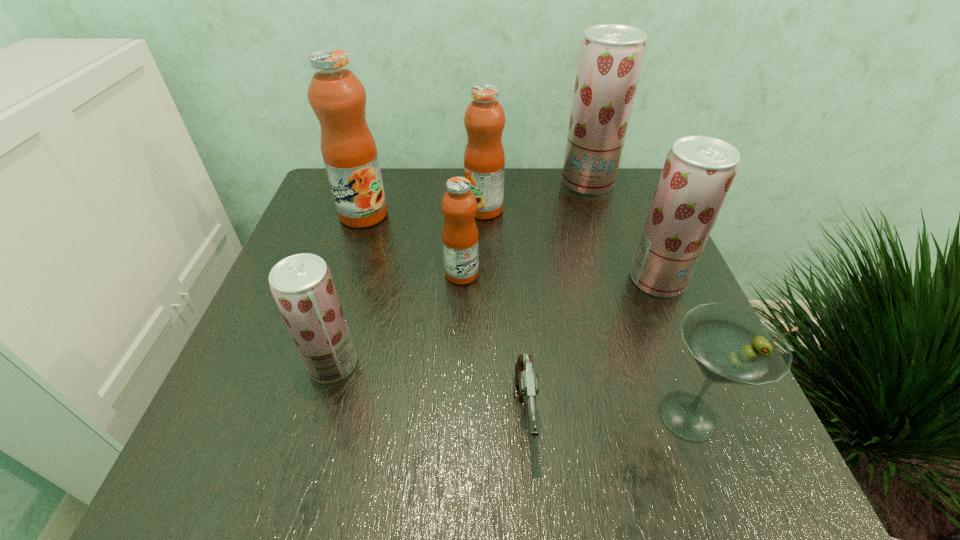
Image resolution: width=960 pixels, height=540 pixels. I want to click on martini that is at the near edge, so pyautogui.click(x=730, y=344).

This screenshot has width=960, height=540. Find the location of `pistol that is at the near edge`. pistol that is at the near edge is located at coordinates (527, 379).

In order to click on martini located in the right edge section of the desktop in this screenshot , I will do point(730,344).

What are the coordinates of `object present at the far left corner` in the screenshot? It's located at (336, 95).

The image size is (960, 540). In order to click on object located at the far right corner in this screenshot , I will do `click(611, 56)`.

Find the location of a particular element. The height and width of the screenshot is (540, 960). object situated at the near right corner is located at coordinates (730, 344).

In the image, there is a desktop. Find the location of `vacant space at the far edge`. vacant space at the far edge is located at coordinates (435, 191).

Image resolution: width=960 pixels, height=540 pixels. Find the location of `vacant region at the near edge of the desktop`. vacant region at the near edge of the desktop is located at coordinates (514, 444).

Where is `vacant position at the left edge of the desktop`? Image resolution: width=960 pixels, height=540 pixels. vacant position at the left edge of the desktop is located at coordinates click(x=245, y=416).

Identify the location of blank space at the right edge of the desktop. (653, 369).